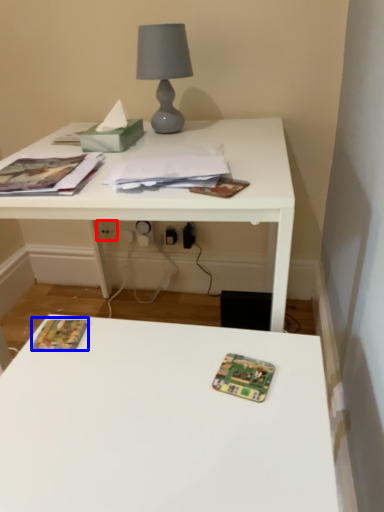
Question: Which object appears closest to the camera in this image, electric outlet (highlighted by a red box) or paperback book (highlighted by a blue box)?

Choices:
 (A) electric outlet
 (B) paperback book

Answer: (B)